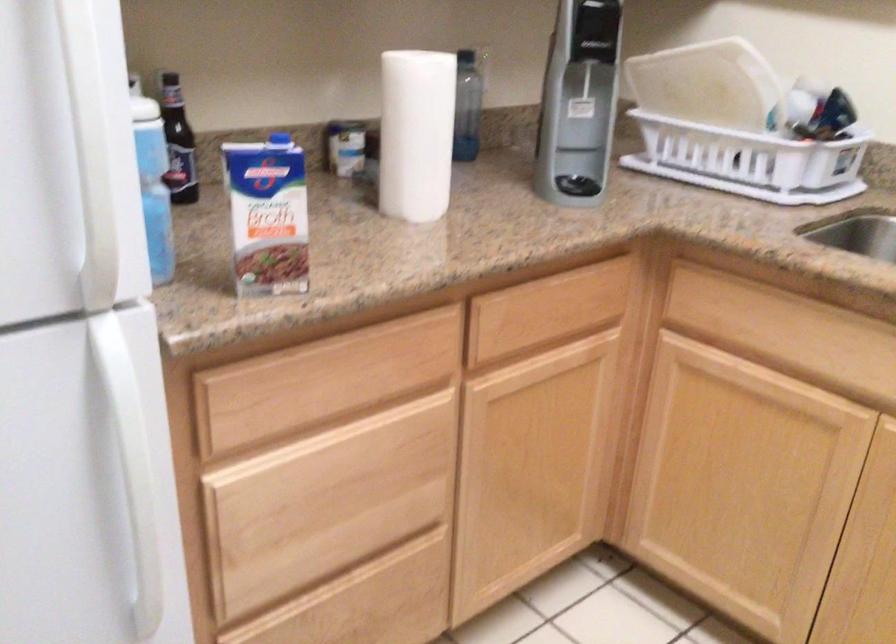
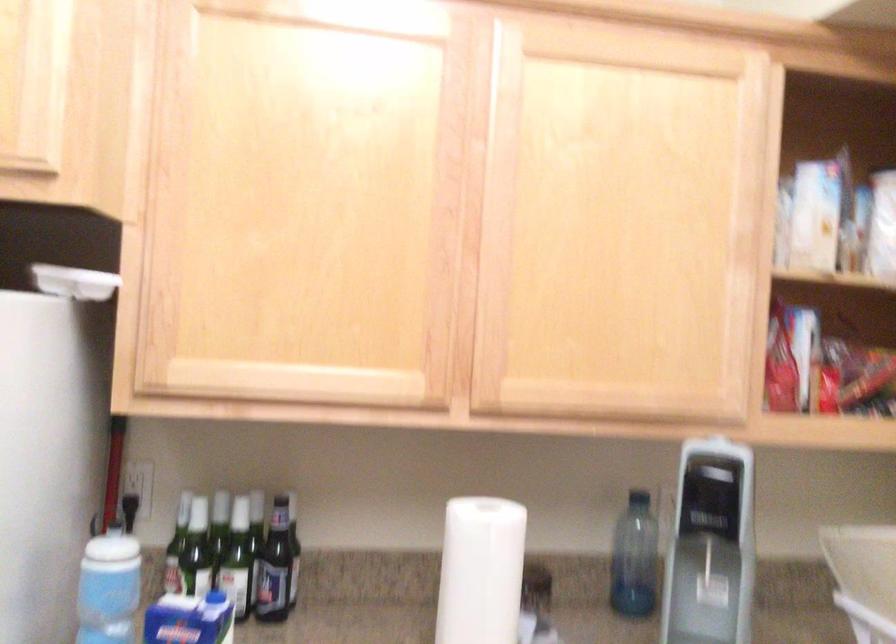
The point at [185,153] is marked in the first image. Where is the corresponding point in the second image?

(274, 567)